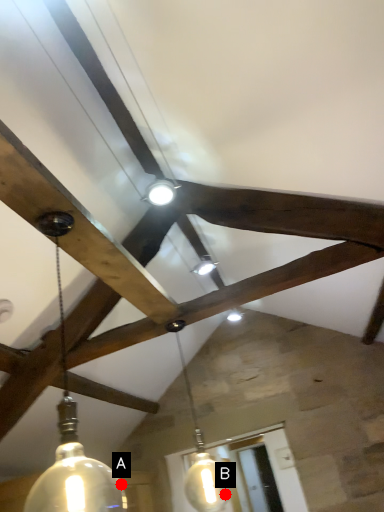
Question: Two points are circled on the image, labeled by A and B beside each circle. Which of the following is the closest to the observer?

Choices:
 (A) A is closer
 (B) B is closer

Answer: (A)